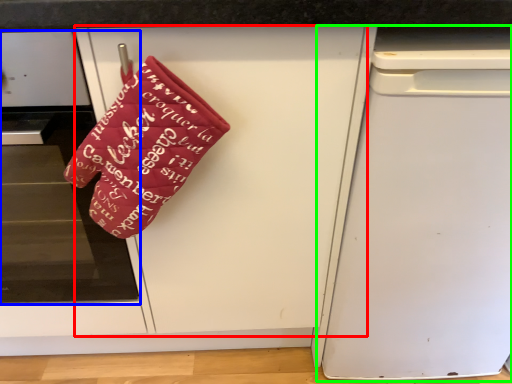
Question: Considering the real-world distances, which object is farthest from door (highlighted by a red box)? home appliance (highlighted by a blue box) or dish washer (highlighted by a green box)?

Choices:
 (A) home appliance
 (B) dish washer

Answer: (A)